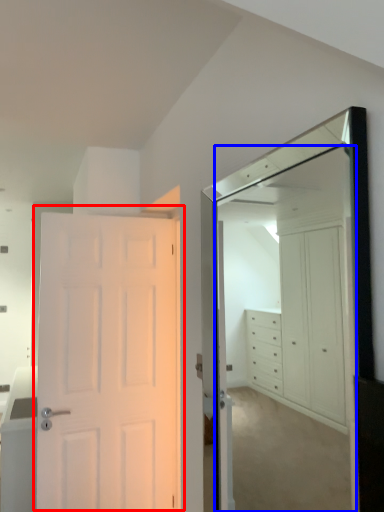
Question: Which object appears farthest to the camera in this image, door (highlighted by a red box) or mirror (highlighted by a blue box)?

Choices:
 (A) door
 (B) mirror

Answer: (A)